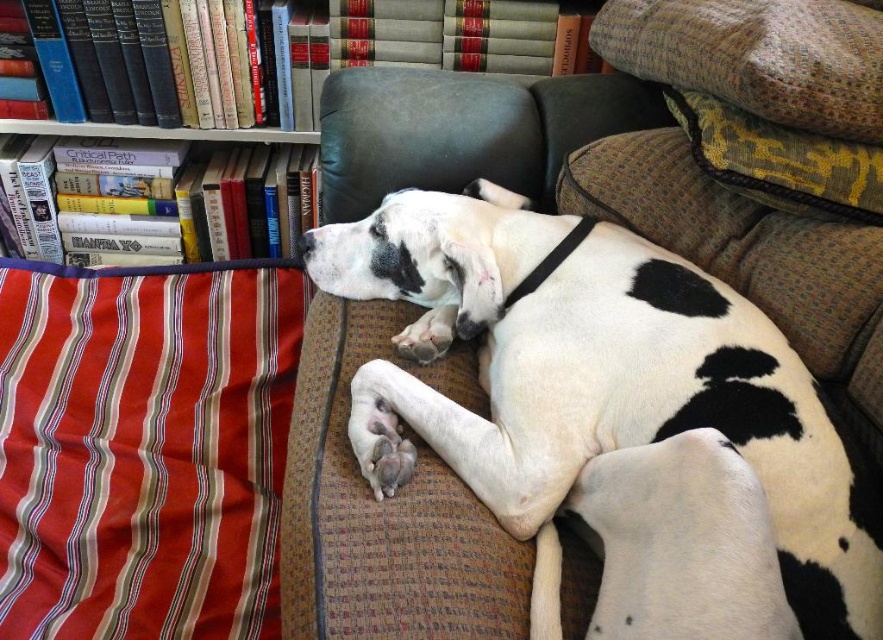
You need to determine which object has a greater thickness between the white fur at center and the striped fabric pillow at left. Based on the scene description, which one is thicker?

The striped fabric pillow at left is thicker than the white fur at center according to the description.